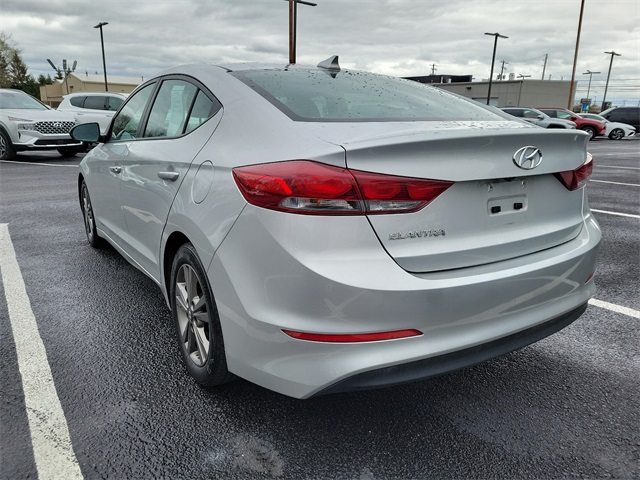
Image resolution: width=640 pixels, height=480 pixels. What are the coordinates of `door handles` in the screenshot? It's located at click(x=114, y=168), click(x=172, y=172).